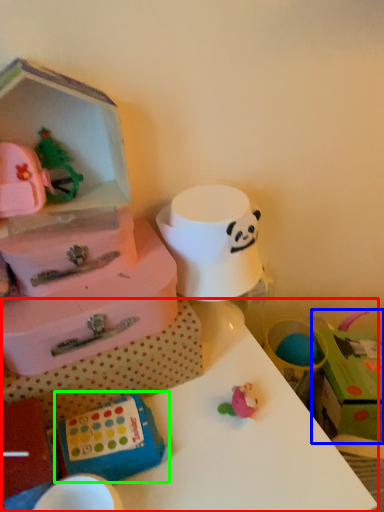
Question: Estimate the real-world distances between objects in this image. Which object is closer to table (highlighted by a red box), storage box (highlighted by a blue box) or box (highlighted by a green box)?

Choices:
 (A) storage box
 (B) box

Answer: (B)